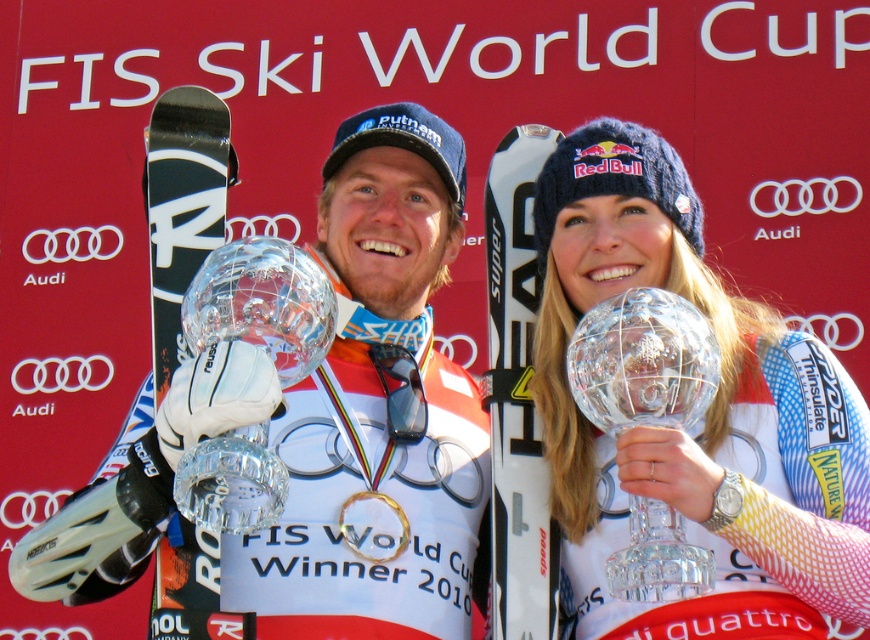
Question: Which point is closer to the camera taking this photo?

Choices:
 (A) (531, 124)
 (B) (340, 509)
 (C) (185, 538)
 (D) (373, 445)

Answer: (C)

Question: Where is white matte ski at center located in relation to clear glass globe at center in the image?

Choices:
 (A) below
 (B) above

Answer: (A)

Question: Among these points, which one is farthest from the camera?

Choices:
 (A) (162, 193)
 (B) (526, 163)

Answer: (B)

Question: Can you confirm if transparent crystal trophy at center is wider than clear glass globe at center?

Choices:
 (A) yes
 (B) no

Answer: (A)

Question: Is clear glass globe at center further to the viewer compared to gold plated ring at center?

Choices:
 (A) yes
 (B) no

Answer: (B)

Question: Which object appears closest to the camera in this image?

Choices:
 (A) black matte ski at left
 (B) matte black snowboard at center

Answer: (B)